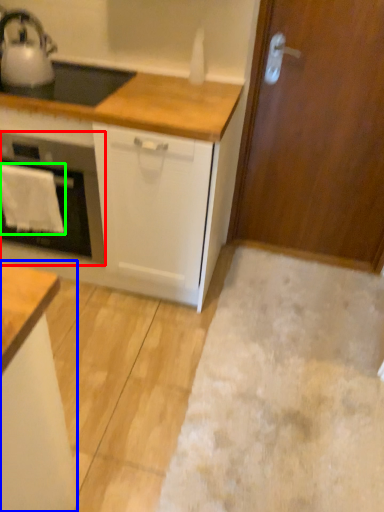
Question: Based on their relative distances, which object is nearer to home appliance (highlighted by a red box)? Choose from cabinetry (highlighted by a blue box) and cloth (highlighted by a green box).

Choices:
 (A) cabinetry
 (B) cloth

Answer: (B)